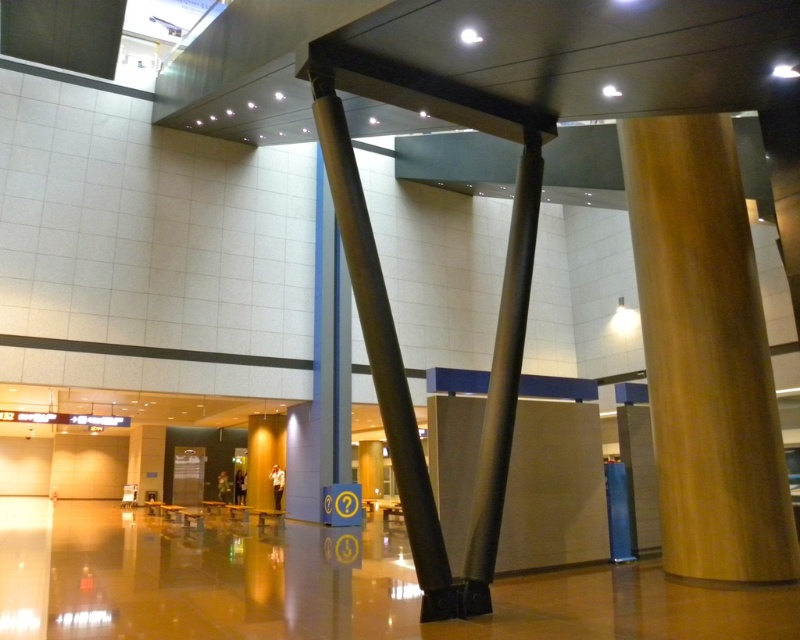
You are an interior designer planning to place a new decorative item between the metallic gray pole at center and the satin gold pole at center. Based on their widths, which pole should the item be placed closer to for better visual balance?

The metallic gray pole at center is wider than the satin gold pole at center, so placing the decorative item closer to the satin gold pole at center would help achieve better visual balance.

You are standing in the modern building and want to place a small sculpture between the two points labeled point (758, 518) and point (494, 412). Which point should you move towards first to ensure the sculpture is closer to the camera?

You should move towards point (494, 412) first because it is closer to the camera than point (758, 518), so placing the sculpture there will keep it nearer to the camera.

You are an interior designer planning to place a new piece of furniture between the gold polished column at center and the metallic gray pole at center. Based on their widths, which column should the furniture be placed closer to for stability?

The gold polished column at center has a larger width than the metallic gray pole at center, so placing the furniture closer to the gold polished column at center would provide better stability due to its wider base.